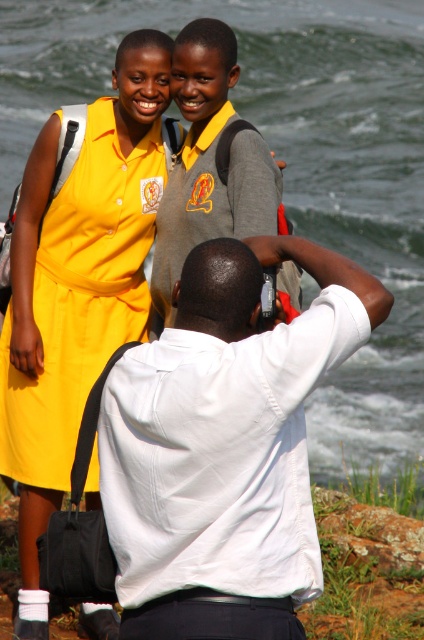
You are a photographer trying to adjust your position to focus on the yellow fabric dress at upper left and the white cotton shirt at center. Which one is closer to you?

The yellow fabric dress at upper left is closer to you because it is further to the viewer than the white cotton shirt at center.

You are trying to decide which outfit takes up more space in the photo. Based on the scene, which object is wider between the white cotton shirt at center and the gray fabric uniform at center?

The white cotton shirt at center is wider than the gray fabric uniform at center according to the description.

You are standing in the scene and want to take a photo of both the yellow fabric dress at upper left and the white cotton shirt at center. Which object should you focus on first to ensure both are in frame?

The yellow fabric dress at upper left is much taller than the white cotton shirt at center, so you should focus on the yellow fabric dress at upper left first to ensure both are in frame.